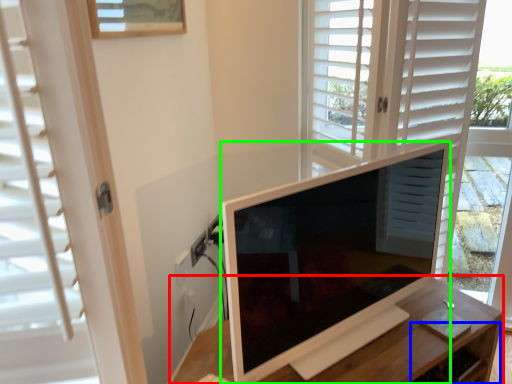
Question: Which is nearer to the table (highlighted by a red box)? drawer (highlighted by a blue box) or television (highlighted by a green box).

Choices:
 (A) drawer
 (B) television

Answer: (A)